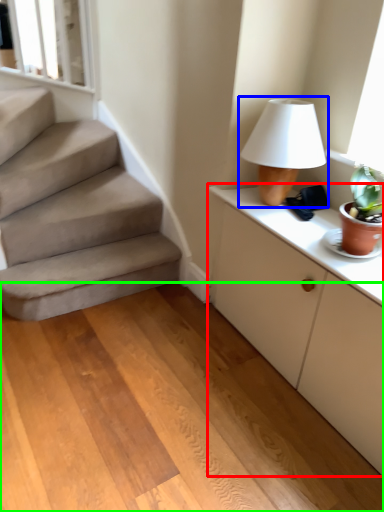
Question: Considering the real-world distances, which object is farthest from cabinetry (highlighted by a red box)? table lamp (highlighted by a blue box) or concrete (highlighted by a green box)?

Choices:
 (A) table lamp
 (B) concrete

Answer: (B)